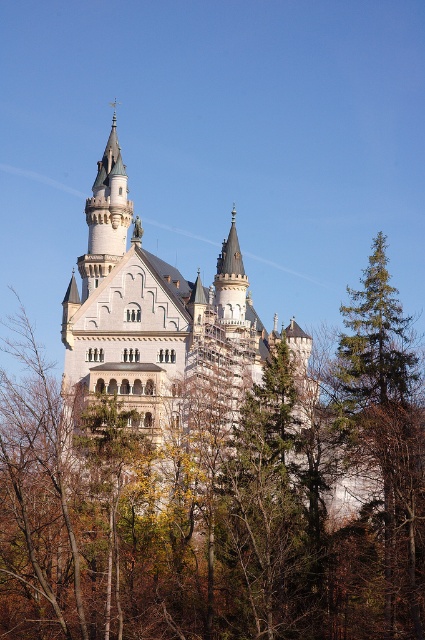
Is white stone castle at center taller than white stone tower at upper center?

Correct, white stone castle at center is much taller as white stone tower at upper center.

Which is in front, point (167, 346) or point (98, 268)?

Point (167, 346) is in front.

Find the location of `white stone castle at center`. white stone castle at center is located at coordinates (155, 314).